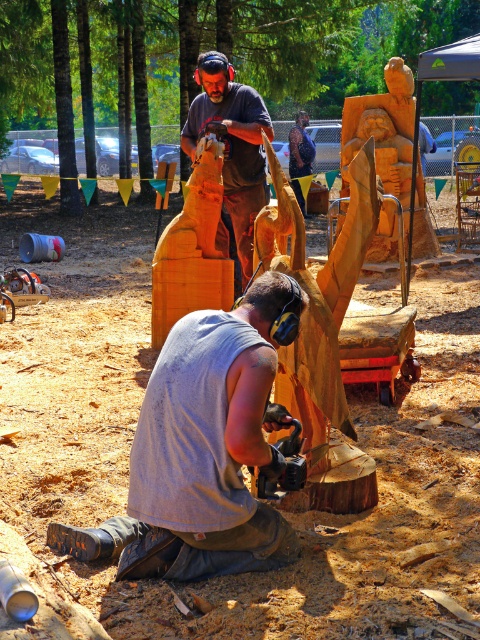
Question: Can you confirm if gray fabric squat at lower center is wider than matte brown wood carving at upper center?

Choices:
 (A) no
 (B) yes

Answer: (B)

Question: Among these objects, which one is farthest from the camera?

Choices:
 (A) gray fabric squat at lower center
 (B) matte brown wood carving at upper center

Answer: (B)

Question: Which of the following is the closest to the observer?

Choices:
 (A) matte brown wood carving at upper center
 (B) gray fabric squat at lower center

Answer: (B)

Question: Is gray fabric squat at lower center in front of matte brown wood carving at upper center?

Choices:
 (A) yes
 (B) no

Answer: (A)

Question: Can you confirm if gray fabric squat at lower center is wider than matte brown wood carving at upper center?

Choices:
 (A) yes
 (B) no

Answer: (A)

Question: Which point is farther to the camera?

Choices:
 (A) gray fabric squat at lower center
 (B) matte brown wood carving at upper center

Answer: (B)